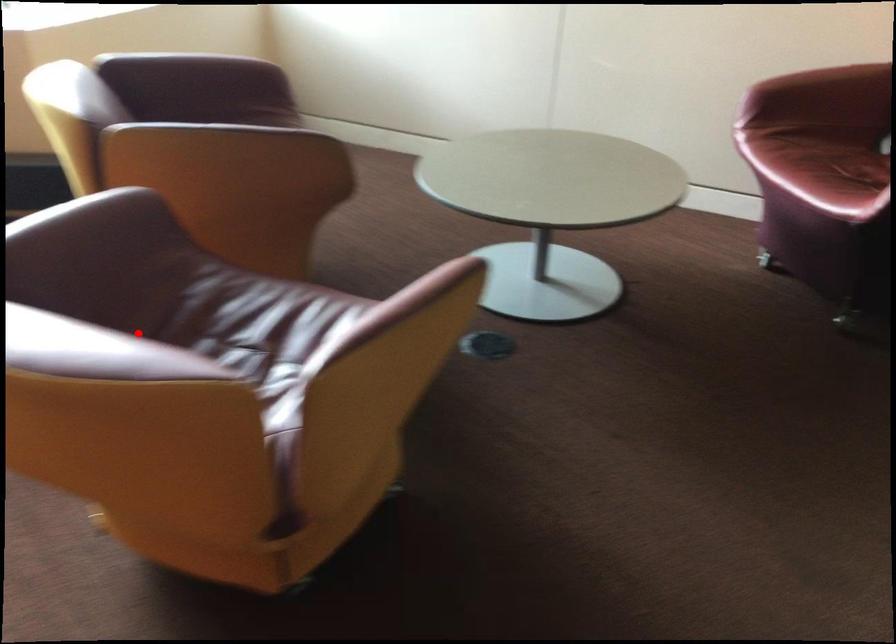
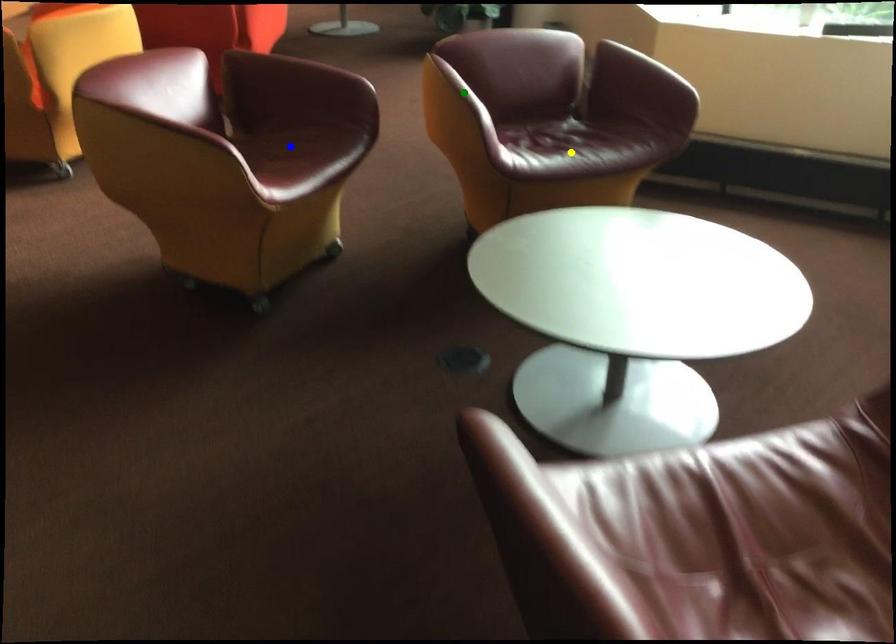
Question: I am providing you with two images of the same scene from different viewpoints. A red point is marked on the first image. You are given multiple points on the second image. Can you choose the point in image 2 that corresponds to the point in image 1?

Choices:
 (A) yellow point
 (B) blue point
 (C) green point

Answer: (B)